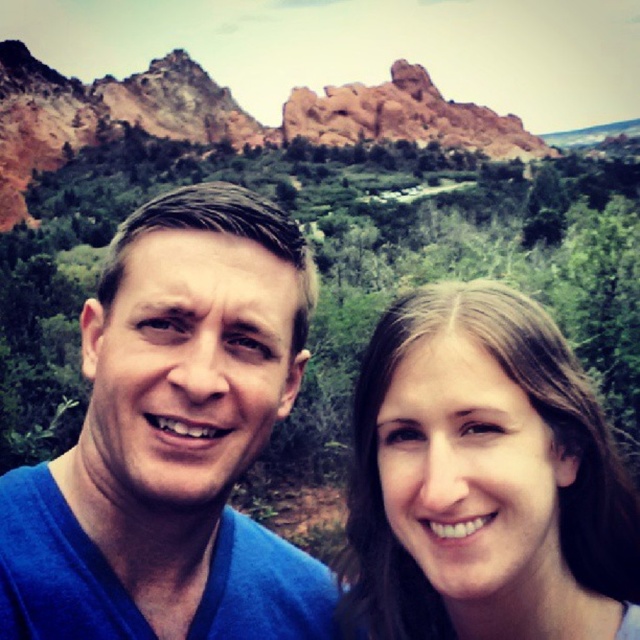
Can you confirm if blue fabric at center is shorter than smooth brown hair at center?

Incorrect, blue fabric at center's height does not fall short of smooth brown hair at center's.

Is the position of blue fabric at center less distant than that of smooth brown hair at center?

That is True.

Which is behind, point (168, 568) or point (500, 291)?

The point (500, 291) is behind.

This screenshot has height=640, width=640. Identify the location of blue fabric at center. (172, 440).